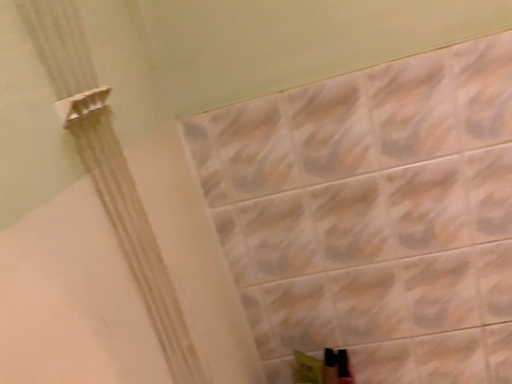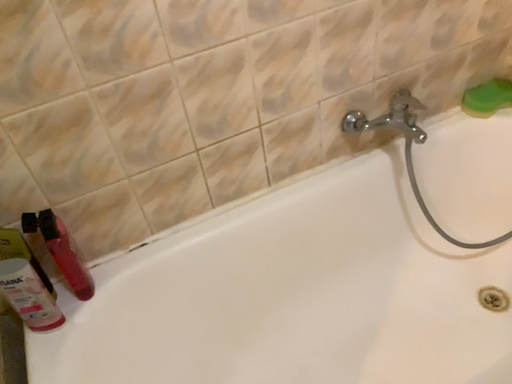
Question: Which way did the camera rotate in the video?

Choices:
 (A) rotated upward
 (B) rotated downward

Answer: (B)